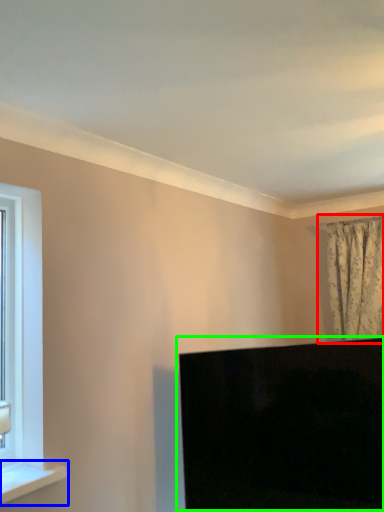
Question: Based on their relative distances, which object is farther from curtain (highlighted by a red box)? Choose from window sill (highlighted by a blue box) and computer monitor (highlighted by a green box).

Choices:
 (A) window sill
 (B) computer monitor

Answer: (A)